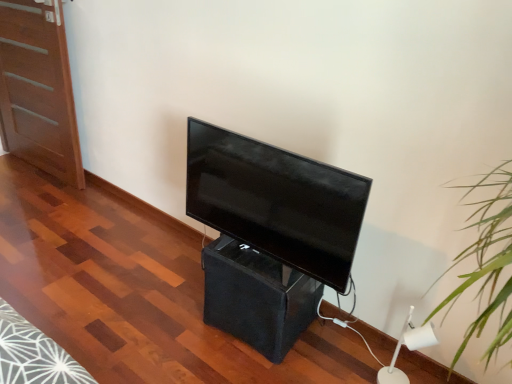
Locate an element on the screen. Image resolution: width=512 pixels, height=384 pixels. free space between black fabric speaker at center and white plastic lamp at lower right is located at coordinates (337, 352).